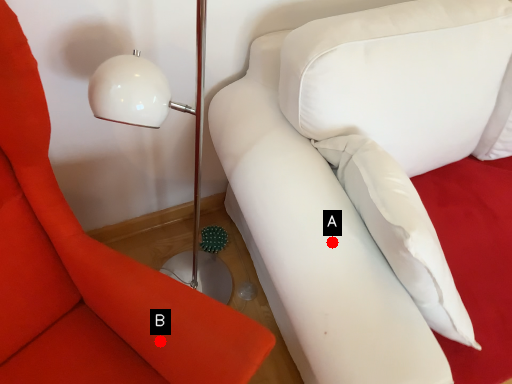
Question: Two points are circled on the image, labeled by A and B beside each circle. Which point is closer to the camera taking this photo?

Choices:
 (A) A is closer
 (B) B is closer

Answer: (B)